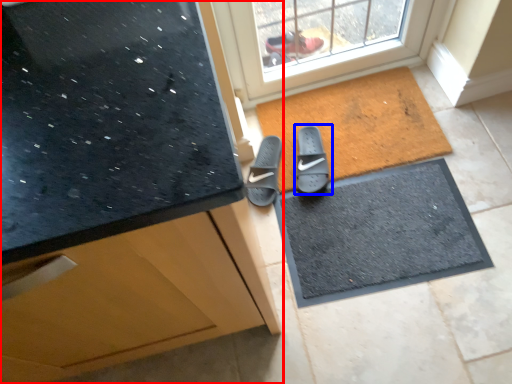
Question: Which of the following is the closest to the observer, cabinetry (highlighted by a red box) or footwear (highlighted by a blue box)?

Choices:
 (A) cabinetry
 (B) footwear

Answer: (A)